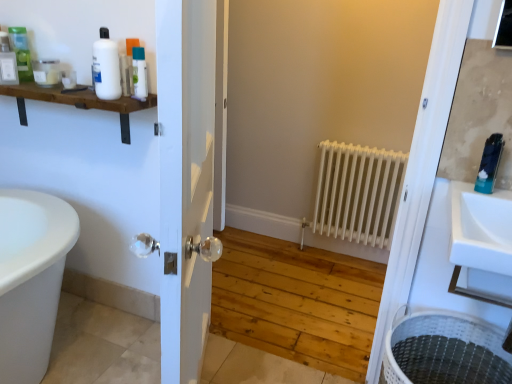
Question: Looking at the image, does matte white bottle at upper left, marked as the 1th toiletry in a left-to-right arrangement, seem bigger or smaller compared to matte green bottle at upper left, which appears as the sixth toiletry when viewed from the right?

Choices:
 (A) big
 (B) small

Answer: (B)

Question: Is matte white bottle at upper left, marked as the 1th toiletry in a left-to-right arrangement, in front of or behind matte green bottle at upper left, which appears as the sixth toiletry when viewed from the right, in the image?

Choices:
 (A) behind
 (B) front

Answer: (A)

Question: Which is farther from the white glossy bottle at upper left, which is the fourth toiletry from right to left?

Choices:
 (A) white matte radiator at center
 (B) white matte shelf at upper left
 (C) matte white bottle at upper left, marked as the 1th toiletry in a left-to-right arrangement
 (D) white woven laundry basket at lower right
 (E) white glossy bottle at upper left, which is counted as the third toiletry, starting from the right

Answer: (D)

Question: Considering the real-world distances, which object is farthest from the white glass door at center?

Choices:
 (A) white matte shelf at upper left
 (B) white glossy bottle at upper left, which is counted as the third toiletry, starting from the right
 (C) white glossy bottle at upper left, which is the fourth toiletry from right to left
 (D) white woven laundry basket at lower right
 (E) white matte radiator at center

Answer: (E)